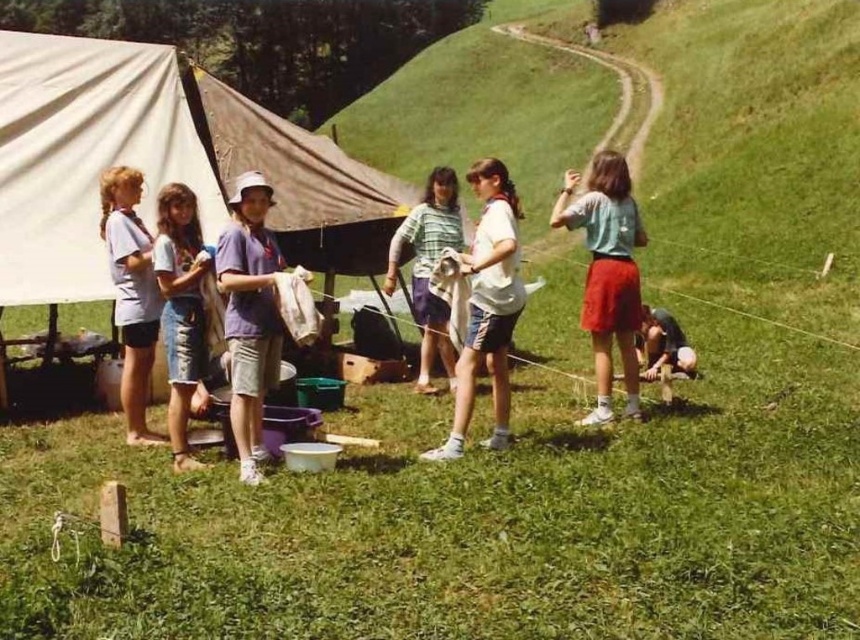
You are standing at the center of the image and want to go to the white canvas tent at left. In which direction should you move?

You should move to the left to reach the white canvas tent at left since it is located at the left side of the image.

You are a photographer trying to capture both the white cotton shirt at center and the green striped shirt at center in the same frame. Which shirt should you focus on first to ensure both are in the frame?

The white cotton shirt at center has a smaller size compared to the green striped shirt at center, so you should focus on the white cotton shirt at center first to ensure both are in the frame.